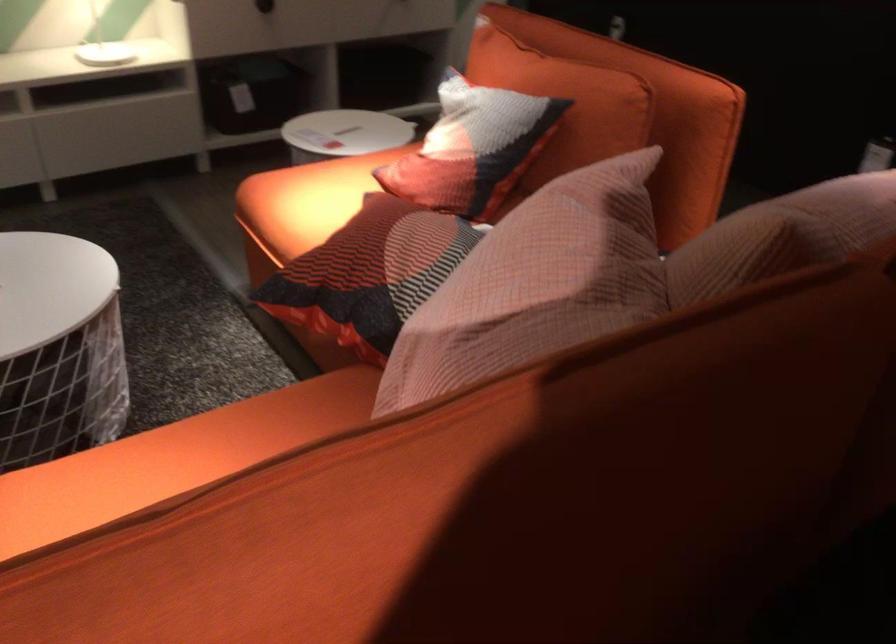
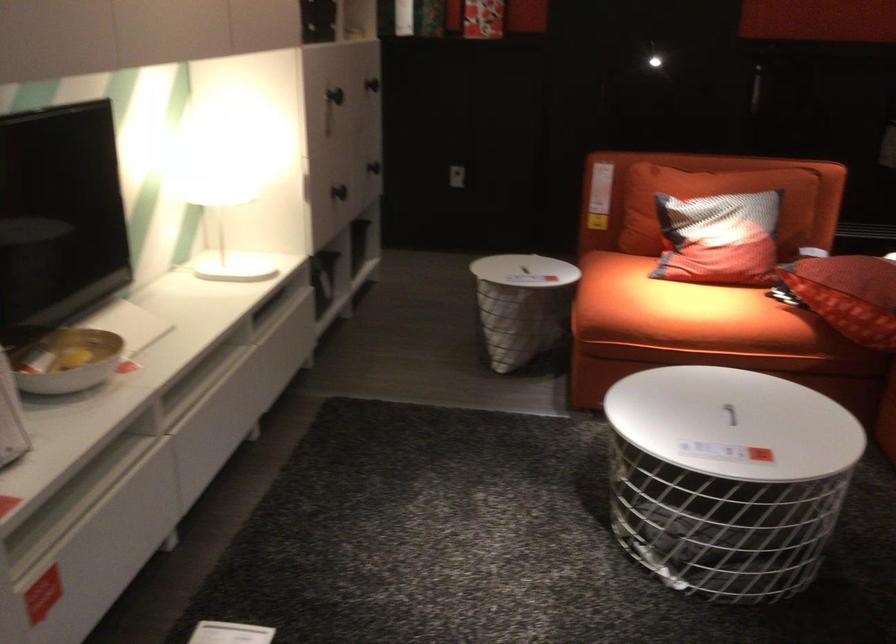
The point at (304, 214) is marked in the first image. Where is the corresponding point in the second image?

(684, 312)